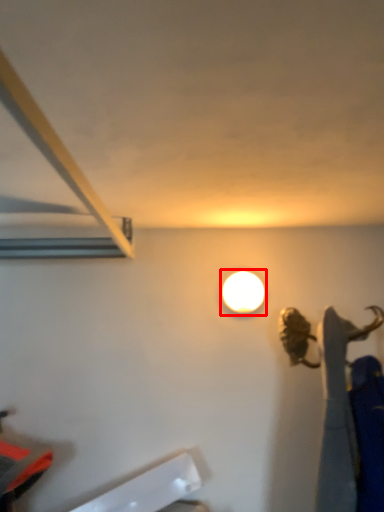
Question: From the image's perspective, considering the relative positions of lamp (annotated by the red box) and wide in the image provided, where is lamp (annotated by the red box) located with respect to the staircase?

Choices:
 (A) above
 (B) below

Answer: (A)